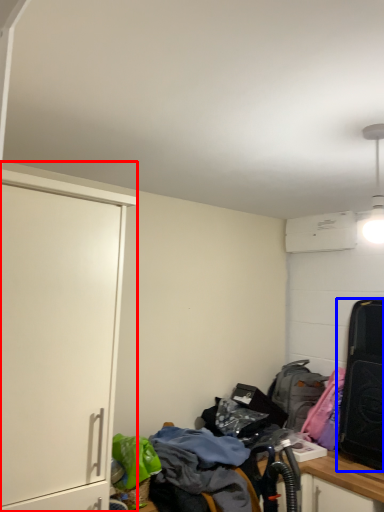
Question: Which object is closer to the camera taking this photo, cabinetry (highlighted by a red box) or luggage and bags (highlighted by a blue box)?

Choices:
 (A) cabinetry
 (B) luggage and bags

Answer: (A)